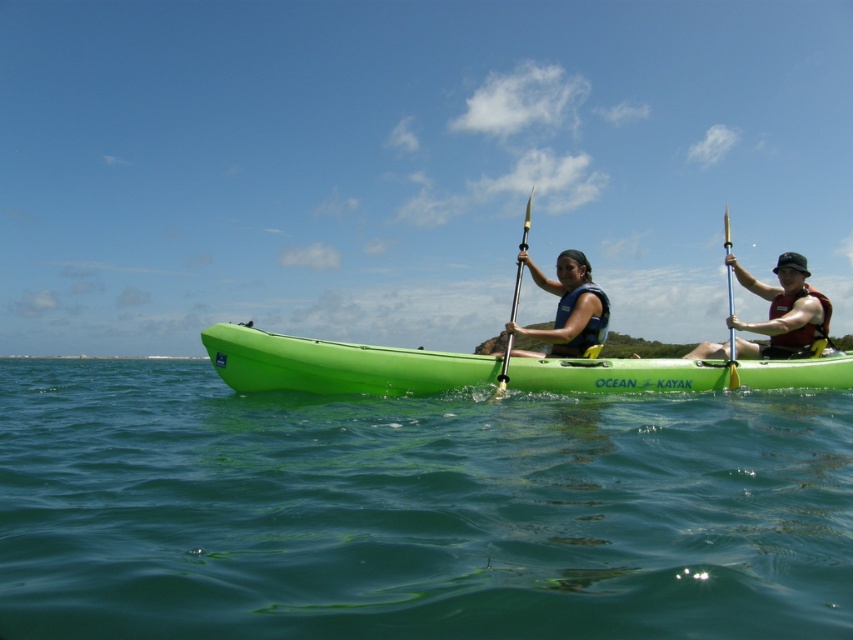
Does green plastic kayak at center appear under matte blue life vest at center?

Yes, green plastic kayak at center is below matte blue life vest at center.

Is point (752, 362) positioned behind point (579, 266)?

No.

The width and height of the screenshot is (853, 640). In order to click on green plastic kayak at center in this screenshot , I will do `click(337, 364)`.

Between green plastic kayak at center and translucent yellow paddle at right, which one appears on the right side from the viewer's perspective?

Positioned to the right is translucent yellow paddle at right.

Which is in front, point (508, 374) or point (723, 221)?

Point (508, 374) is in front.

Is point (834, 362) farther from viewer compared to point (726, 228)?

No, (834, 362) is closer to viewer.

You are a GUI agent. You are given a task and a screenshot of the screen. Output one action in this format:
    pyautogui.click(x=<x>, y=<y>)
    Task: Click on the green plastic kayak at center
    
    Given the screenshot: What is the action you would take?
    pyautogui.click(x=337, y=364)

Is green water at center to the right of matte blue life vest at center from the viewer's perspective?

Incorrect, green water at center is not on the right side of matte blue life vest at center.

Which is behind, point (16, 387) or point (602, 326)?

Point (16, 387)

Between point (727, 420) and point (583, 298), which one is positioned in front?

Positioned in front is point (727, 420).

At what (x,y) coordinates should I click in order to perform the action: click on green water at center. Please return your answer as a coordinate pair (x, y). Image resolution: width=853 pixels, height=640 pixels. Looking at the image, I should click on (415, 509).